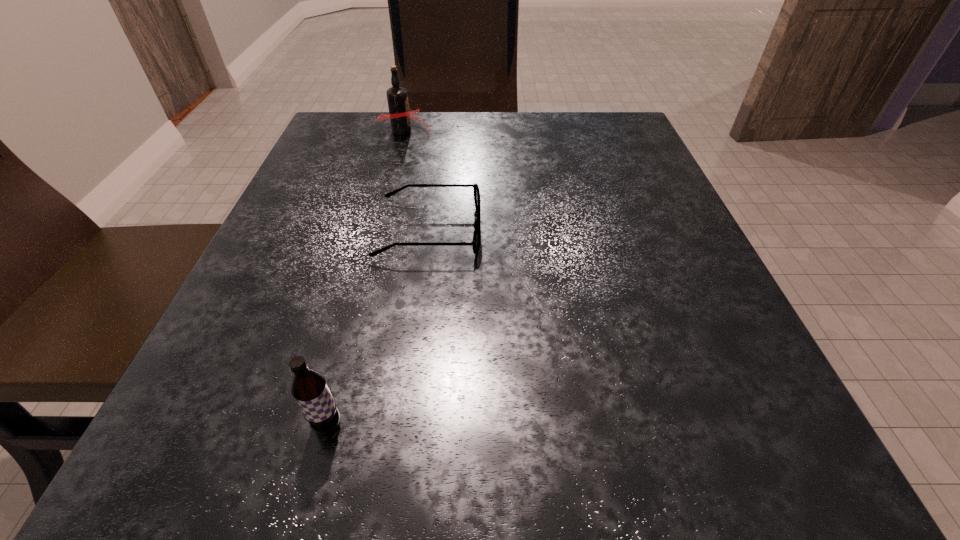
Locate an element on the screen. This screenshot has width=960, height=540. the farther root beer is located at coordinates (400, 116).

Locate an element on the screen. The image size is (960, 540). the nearest object is located at coordinates (309, 388).

Where is `the nearer root beer`? This screenshot has height=540, width=960. the nearer root beer is located at coordinates (309, 388).

Where is `the second farthest object`? This screenshot has width=960, height=540. the second farthest object is located at coordinates (477, 223).

Locate an element on the screen. Image resolution: width=960 pixels, height=540 pixels. the shortest object is located at coordinates (477, 223).

This screenshot has height=540, width=960. In order to click on vacant space situated on the label of the farther root beer in this screenshot , I will do `click(488, 131)`.

Find the location of a particular element. This screenshot has width=960, height=540. free region located 0.080m on the left of the nearer root beer is located at coordinates (242, 424).

I want to click on vacant area situated 0.300m on the front-facing side of the spectacles, so click(x=658, y=231).

Where is `object located at the far edge`? This screenshot has width=960, height=540. object located at the far edge is located at coordinates (400, 116).

The image size is (960, 540). I want to click on object that is at the near edge, so click(x=309, y=388).